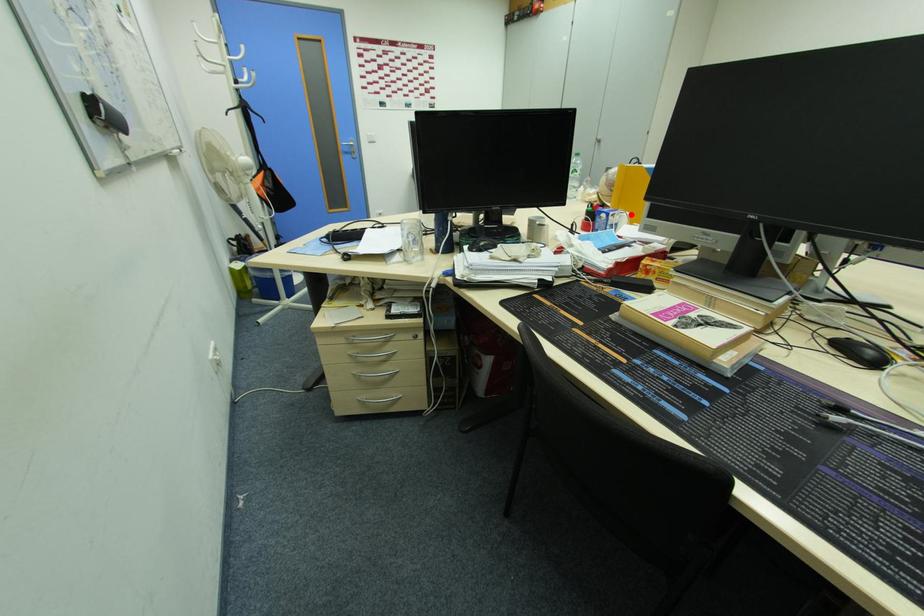
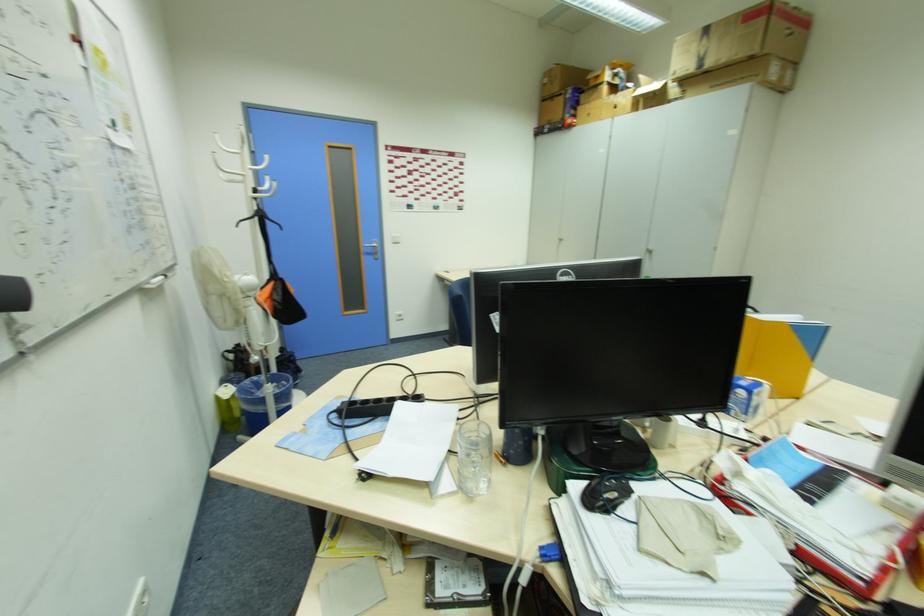
In the second image, find the point that corresponds to the highlighted location in the first image.

(772, 384)